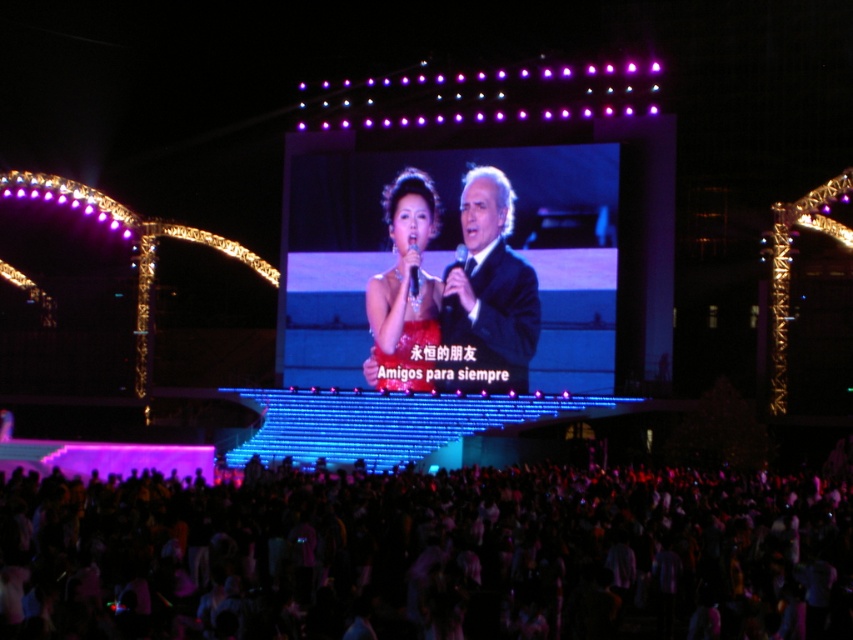
Question: Is black fabric crowd at lower center below black satin suit at center?

Choices:
 (A) no
 (B) yes

Answer: (B)

Question: Is shiny red dress at center to the right of black glossy microphone at center from the viewer's perspective?

Choices:
 (A) yes
 (B) no

Answer: (B)

Question: Estimate the real-world distances between objects in this image. Which object is farther from the shiny black screen at center?

Choices:
 (A) black fabric crowd at lower center
 (B) black plastic microphone at center
 (C) black glossy microphone at center

Answer: (A)

Question: Can you confirm if black fabric crowd at lower center is positioned below black plastic microphone at center?

Choices:
 (A) no
 (B) yes

Answer: (B)

Question: Which point is farther from the camera taking this photo?

Choices:
 (A) pyautogui.click(x=467, y=218)
 (B) pyautogui.click(x=415, y=269)
 (C) pyautogui.click(x=397, y=248)

Answer: (C)

Question: Estimate the real-world distances between objects in this image. Which object is farther from the shiny black screen at center?

Choices:
 (A) black fabric crowd at lower center
 (B) black satin suit at center
 (C) black glossy microphone at center

Answer: (A)